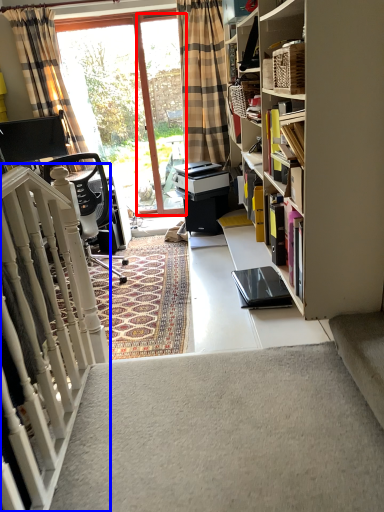
Question: Which of the following is the farthest to the observer, screen door (highlighted by a red box) or stairs (highlighted by a blue box)?

Choices:
 (A) screen door
 (B) stairs

Answer: (A)